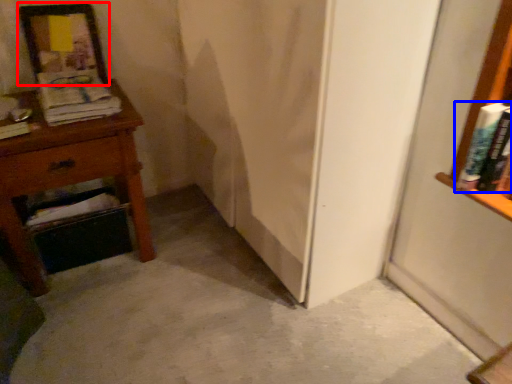
Question: Which object appears closest to the camera in this image, picture frame (highlighted by a red box) or book (highlighted by a blue box)?

Choices:
 (A) picture frame
 (B) book

Answer: (B)